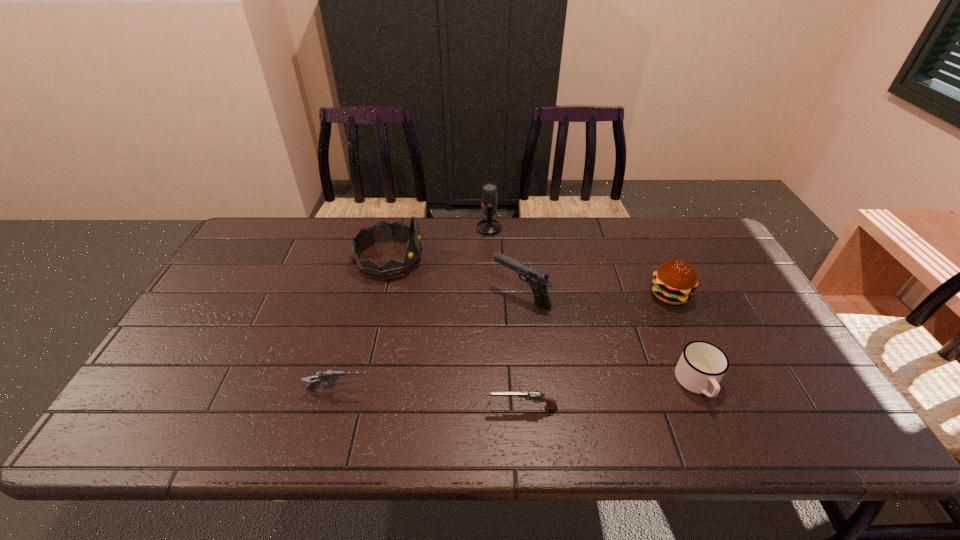
Where is `microphone`? microphone is located at coordinates pos(489,226).

The height and width of the screenshot is (540, 960). I want to click on tiara, so click(382, 231).

This screenshot has width=960, height=540. What are the coordinates of `the tallest gun` in the screenshot? It's located at 538,280.

At what (x,y) coordinates should I click in order to perform the action: click on hamburger. Please return your answer as a coordinate pair (x, y). This screenshot has height=540, width=960. Looking at the image, I should click on (674, 281).

Locate an element on the screen. mug is located at coordinates (702, 365).

I want to click on the leftmost gun, so click(330, 377).

At what (x,y) coordinates should I click in order to perform the action: click on the shortest object. Please return your answer as a coordinate pair (x, y). The width and height of the screenshot is (960, 540). Looking at the image, I should click on (536, 396).

In order to click on the nearest gun in this screenshot , I will do `click(536, 396)`.

Find the location of `free spot located on the side of the microphone with the red ring`. free spot located on the side of the microphone with the red ring is located at coordinates (371, 228).

The image size is (960, 540). I want to click on free space located 0.280m on the side of the microphone with the red ring, so click(396, 228).